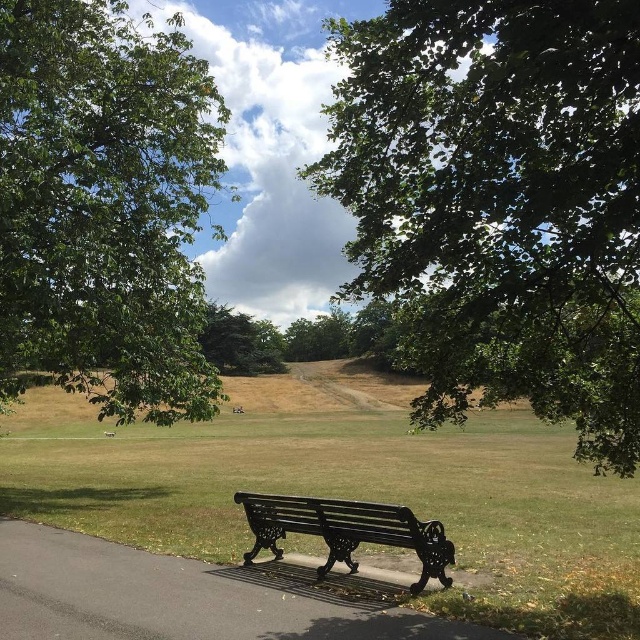
Question: Is green leafy tree at upper right wider than green textured tree at center?

Choices:
 (A) no
 (B) yes

Answer: (A)

Question: From the image, what is the correct spatial relationship of green grass bench at center in relation to green textured tree at center?

Choices:
 (A) below
 (B) above

Answer: (A)

Question: Is green grass bench at center bigger than black cast iron bench at lower center?

Choices:
 (A) no
 (B) yes

Answer: (B)

Question: Which point is closer to the camera?

Choices:
 (A) green textured tree at center
 (B) black metal bench at center
 (C) black cast iron bench at lower center
 (D) green leafy tree at upper right

Answer: (D)

Question: Which point is farther to the camera?

Choices:
 (A) green leafy tree at upper right
 (B) black metal bench at center
 (C) green grass bench at center
 (D) green leafy tree at upper left

Answer: (D)

Question: Among these points, which one is farthest from the camera?

Choices:
 (A) (365, 115)
 (B) (380, 541)
 (C) (170, 97)
 (D) (42, 563)

Answer: (C)